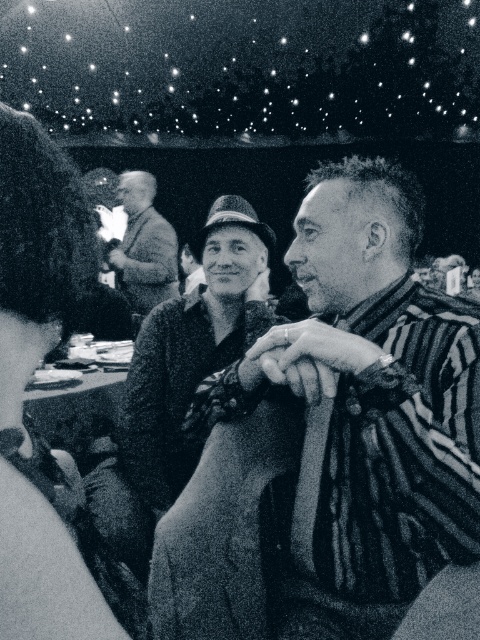
You are standing in the scene and want to move from the point closer to you to the point further away. Which path would you take between the two points, point (311, 268) and point (141, 253)?

You should move from point (311, 268) to point (141, 253) because point (311, 268) is closer to the viewer and you need to go towards the point that is further away.

Looking at this image, you are at an event and want to take a photo of both the striped sweater at center and the light brown textured sweater at center. Which sweater should you focus on first to ensure both are in focus?

You should focus on the striped sweater at center first since it is closer to the viewer than the light brown textured sweater at center. By focusing on the closer object, the depth of field may extend to include the farther one as well.

Consider the image. In the image, there is a smooth fabric napkin at left. Where exactly is it located in terms of coordinates?

The smooth fabric napkin at left is located at point coordinates of (32, 372).